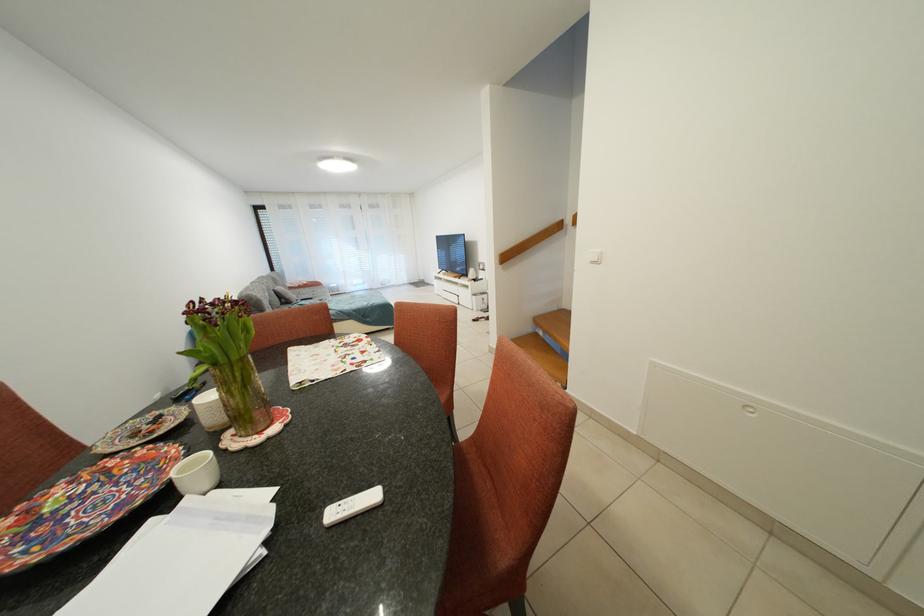
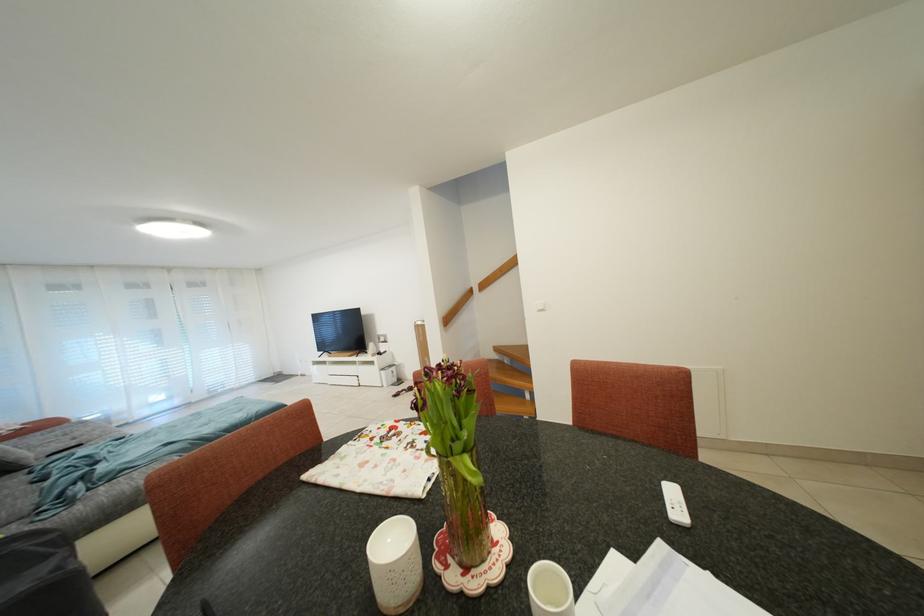
Locate, in the second image, the point that corresponds to (296,301) in the first image.

(19, 462)